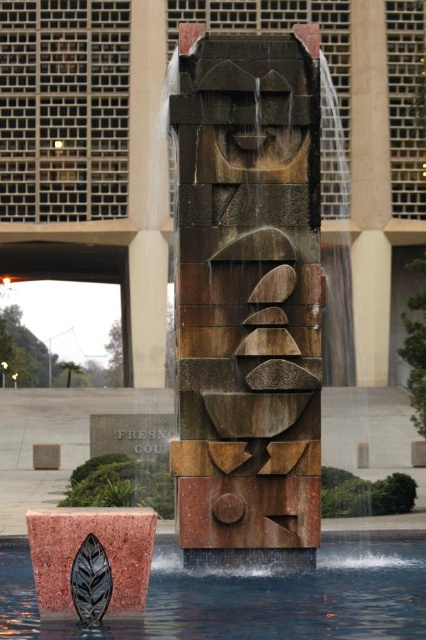
Question: Which object appears closest to the camera in this image?

Choices:
 (A) rustic stone face at center
 (B) metallic water at leaf bottom
 (C) marble column at center-right
 (D) rustic stone sculpture at center

Answer: (B)

Question: Is marble column at center-right thinner than rustic stone sculpture at center?

Choices:
 (A) no
 (B) yes

Answer: (B)

Question: Which object appears farthest from the camera in this image?

Choices:
 (A) rustic stone face at center
 (B) metallic water at leaf bottom

Answer: (A)

Question: Does metallic water at leaf bottom have a larger size compared to marble column at center-right?

Choices:
 (A) yes
 (B) no

Answer: (B)

Question: Does rustic stone face at center appear over metallic water at leaf bottom?

Choices:
 (A) yes
 (B) no

Answer: (A)

Question: Which object appears closest to the camera in this image?

Choices:
 (A) rustic stone sculpture at center
 (B) metallic water at leaf bottom

Answer: (B)